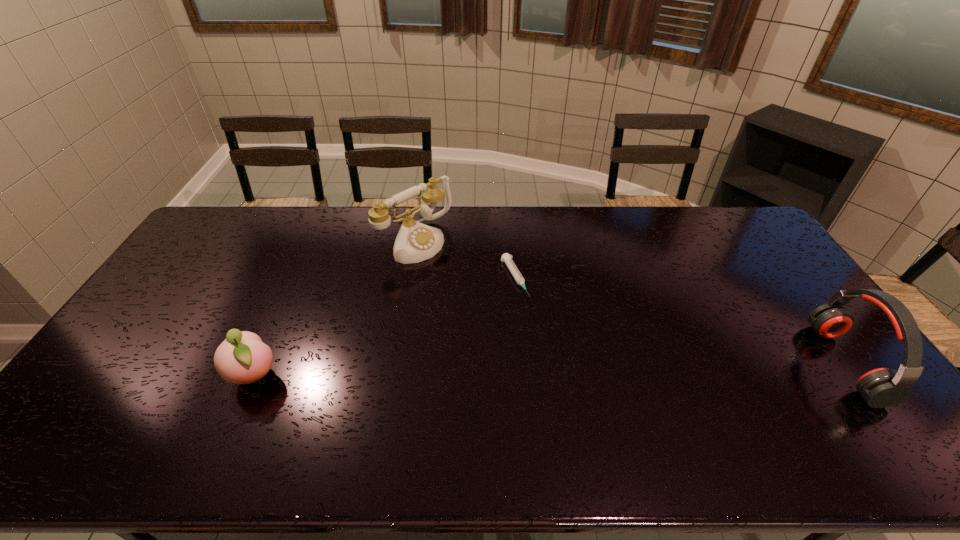
This screenshot has width=960, height=540. I want to click on the leftmost object, so click(242, 358).

Image resolution: width=960 pixels, height=540 pixels. Identify the location of peach. (242, 358).

At what (x,y) coordinates should I click in order to perform the action: click on earphone. Please return your answer as a coordinate pair (x, y). The height and width of the screenshot is (540, 960). Looking at the image, I should click on (883, 387).

Identify the location of telephone. The height and width of the screenshot is (540, 960). (415, 242).

Identify the location of the shortest object. (507, 258).

This screenshot has width=960, height=540. I want to click on the second object from right to left, so click(x=507, y=258).

Find the location of a particular element. The height and width of the screenshot is (540, 960). vacant area situated on the back of the leftmost object is located at coordinates (299, 278).

Where is `vacant space situated 0.320m on the ear cups of the rightmost object`? This screenshot has width=960, height=540. vacant space situated 0.320m on the ear cups of the rightmost object is located at coordinates (710, 363).

Locate an element on the screen. The image size is (960, 540). vacant space located on the ear cups of the rightmost object is located at coordinates (714, 363).

You are a GUI agent. You are given a task and a screenshot of the screen. Output one action in this format:
    pyautogui.click(x=<x>, y=<y>)
    Task: Click on the free spot located on the ear cups of the rightmost object
    The width and height of the screenshot is (960, 540).
    Given the screenshot: What is the action you would take?
    pyautogui.click(x=684, y=363)